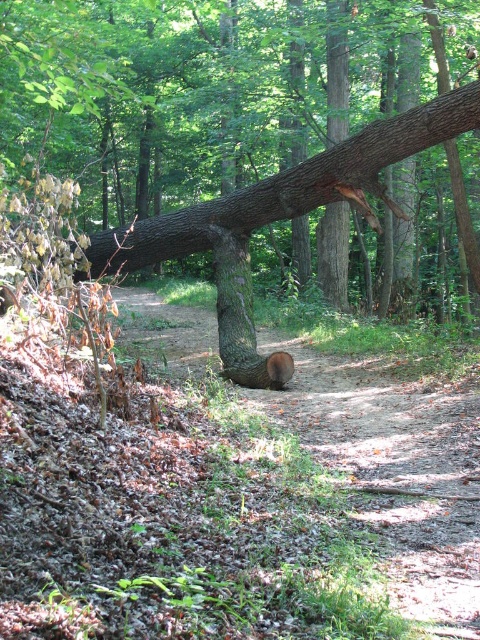
Question: Which of these objects is positioned closest to the smooth brown log at center?

Choices:
 (A) brown rough tree trunk at center
 (B) brown rough tree stump at center

Answer: (A)

Question: Is brown rough tree stump at center closer to the viewer compared to brown rough tree trunk at center?

Choices:
 (A) yes
 (B) no

Answer: (A)

Question: Which object is farther from the camera taking this photo?

Choices:
 (A) brown rough tree trunk at center
 (B) smooth brown log at center
 (C) brown rough tree stump at center

Answer: (A)

Question: Does brown rough tree stump at center appear on the right side of brown rough tree trunk at center?

Choices:
 (A) yes
 (B) no

Answer: (A)

Question: Which object is closer to the camera taking this photo?

Choices:
 (A) smooth brown log at center
 (B) brown rough tree stump at center

Answer: (B)

Question: Can you confirm if smooth brown log at center is bigger than brown rough tree trunk at center?

Choices:
 (A) yes
 (B) no

Answer: (A)